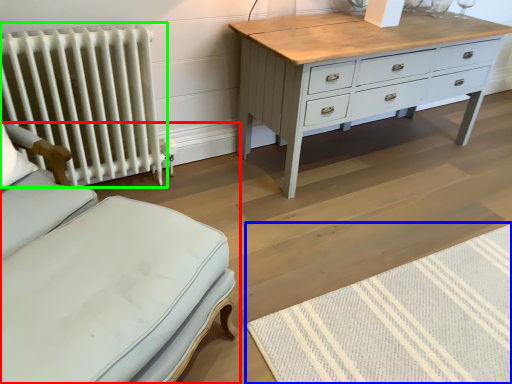
Question: Which object is positioned closest to furniture (highlighted by a red box)? Select from mat (highlighted by a blue box) and radiator (highlighted by a green box).

Choices:
 (A) mat
 (B) radiator

Answer: (A)